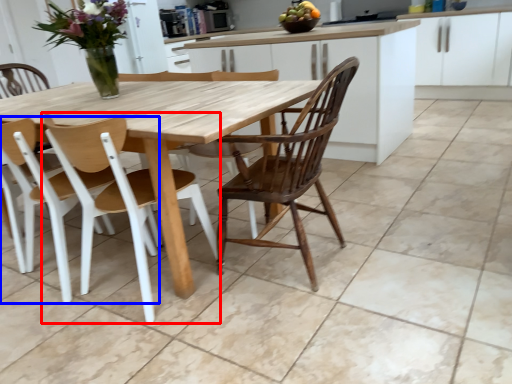
Question: Which object appears closest to the camera in this image, chair (highlighted by a red box) or chair (highlighted by a blue box)?

Choices:
 (A) chair
 (B) chair

Answer: (A)